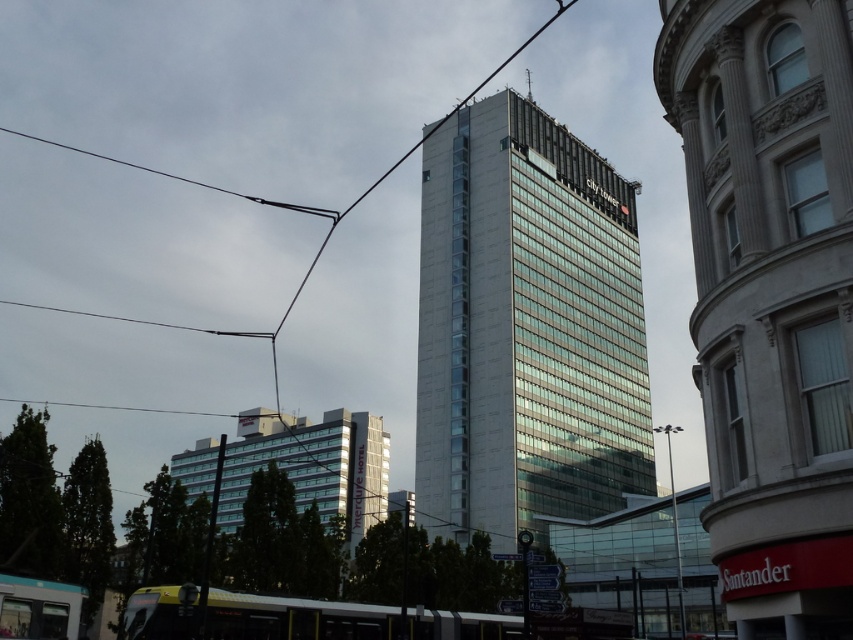
Who is more distant from viewer, (512,180) or (204,184)?

The point (204,184) is more distant.

Does matte glass building at center appear on the left side of black wire at upper left?

In fact, matte glass building at center is to the right of black wire at upper left.

Where is `matte glass building at center`? matte glass building at center is located at coordinates (526, 326).

Locate an element on the screen. The width and height of the screenshot is (853, 640). matte glass building at center is located at coordinates (526, 326).

Does point (538, 403) lie behind point (254, 605)?

Yes, point (538, 403) is behind point (254, 605).

Is matte glass building at center above metallic silver bus at lower center?

Yes, matte glass building at center is above metallic silver bus at lower center.

Between point (531, 508) and point (433, 618), which one is positioned behind?

The point (531, 508) is behind.

You are a GUI agent. You are given a task and a screenshot of the screen. Output one action in this format:
    pyautogui.click(x=<x>, y=<y>)
    Task: Click on the matte glass building at center
    
    Given the screenshot: What is the action you would take?
    pyautogui.click(x=526, y=326)

Is metallic silver bus at lower center positioned at the back of black wire at upper left?

No, metallic silver bus at lower center is closer to the viewer.

Can you confirm if metallic silver bus at lower center is positioned to the left of black wire at upper left?

Incorrect, metallic silver bus at lower center is not on the left side of black wire at upper left.

Who is more distant from viewer, (x=173, y=628) or (x=67, y=148)?

Point (x=67, y=148)

At what (x,y) coordinates should I click in order to perform the action: click on metallic silver bus at lower center. Please return your answer as a coordinate pair (x, y). Looking at the image, I should click on (343, 620).